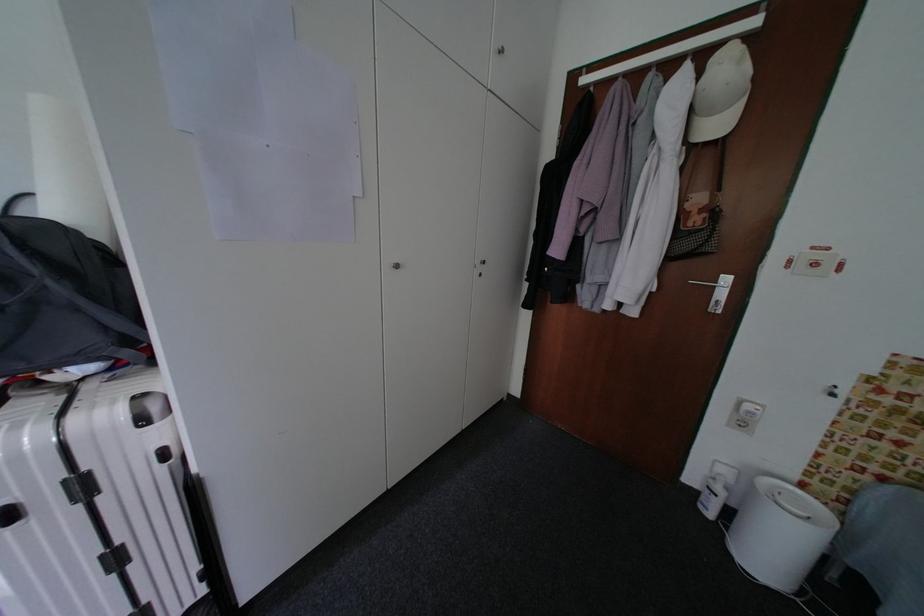
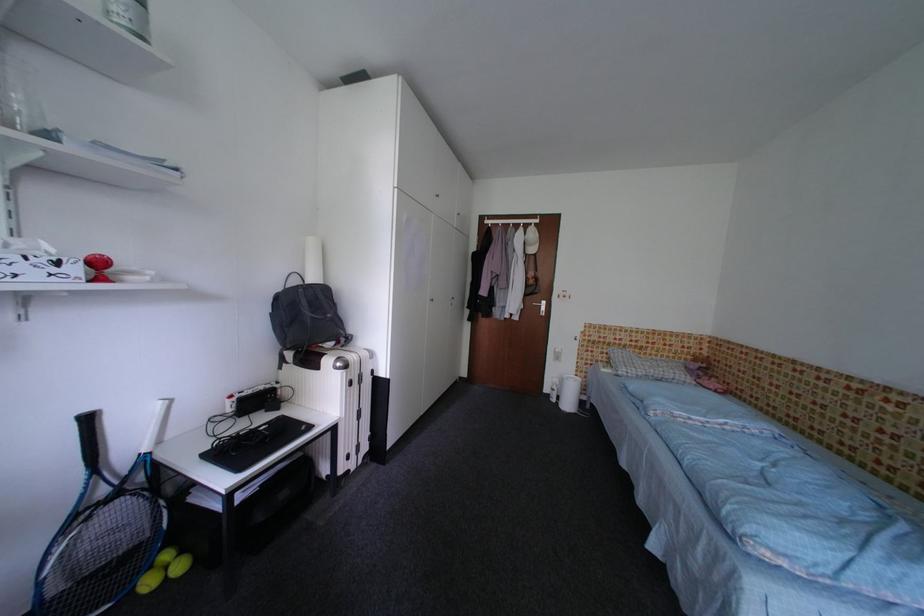
What movement of the cameraman would produce the second image?

The cameraman moved toward left, backward.